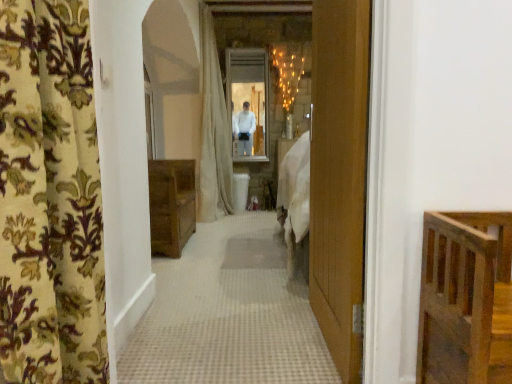
The height and width of the screenshot is (384, 512). I want to click on white glossy mirror at center, so click(x=249, y=101).

Locate an element on the screen. Image resolution: width=512 pixels, height=384 pixels. curtain below the beige fabric shower curtain at center (from a real-world perspective) is located at coordinates (50, 198).

What's the angular difference between beige fabric shower curtain at center and floral-patterned fabric at left's facing directions?

beige fabric shower curtain at center and floral-patterned fabric at left are facing 2.16 degrees away from each other.

Is the depth of beige fabric shower curtain at center greater than that of floral-patterned fabric at left?

Yes.

Which of these two, beige fabric shower curtain at center or floral-patterned fabric at left, is wider?

With larger width is beige fabric shower curtain at center.

Which is in front, floral-patterned fabric at left or beige fabric shower curtain at center?

Positioned in front is floral-patterned fabric at left.

Who is shorter, floral-patterned fabric at left or beige fabric shower curtain at center?

floral-patterned fabric at left.

Is floral-patterned fabric at left at the right side of beige fabric shower curtain at center?

Yes.

Who is smaller, beige fabric shower curtain at center or white glossy mirror at center?

Smaller between the two is white glossy mirror at center.

From the image's perspective, is beige fabric shower curtain at center below white glossy mirror at center?

Indeed, from the image's perspective, beige fabric shower curtain at center is shown beneath white glossy mirror at center.

Is beige fabric shower curtain at center positioned with its back to white glossy mirror at center?

beige fabric shower curtain at center does not have its back to white glossy mirror at center.

Which point is more distant from viewer, (202, 29) or (263, 155)?

The point (263, 155) is more distant.

In terms of width, does white glossy mirror at center look wider or thinner when compared to beige fabric shower curtain at center?

Clearly, white glossy mirror at center has less width compared to beige fabric shower curtain at center.

Is beige fabric shower curtain at center at the back of white glossy mirror at center?

No, white glossy mirror at center is not facing away from beige fabric shower curtain at center.

What's the angular difference between white glossy mirror at center and beige fabric shower curtain at center's facing directions?

There is a 88.4-degree angle between the facing directions of white glossy mirror at center and beige fabric shower curtain at center.

What are the coordinates of `mirror behind the beige fabric shower curtain at center` in the screenshot? It's located at (249, 101).

Between floral-patterned fabric at left and white glossy mirror at center, which one appears on the right side from the viewer's perspective?

white glossy mirror at center is more to the right.

Is floral-patterned fabric at left bigger than white glossy mirror at center?

Indeed, floral-patterned fabric at left has a larger size compared to white glossy mirror at center.

From the image's perspective, between floral-patterned fabric at left and white glossy mirror at center, which one is located above?

white glossy mirror at center is shown above in the image.

In the scene shown: Is floral-patterned fabric at left not close to white glossy mirror at center?

That's right, there is a large distance between floral-patterned fabric at left and white glossy mirror at center.

From the image's perspective, which is above, white glossy mirror at center or floral-patterned fabric at left?

white glossy mirror at center.

Based on the photo, is white glossy mirror at center in front of or behind floral-patterned fabric at left in the image?

white glossy mirror at center is behind floral-patterned fabric at left.

Is white glossy mirror at center in contact with floral-patterned fabric at left?

There is a gap between white glossy mirror at center and floral-patterned fabric at left.

Does point (244, 71) come closer to viewer compared to point (53, 285)?

No, it is behind (53, 285).

This screenshot has height=384, width=512. What are the coordinates of `curtain on the right of beige fabric shower curtain at center` in the screenshot? It's located at (50, 198).

The height and width of the screenshot is (384, 512). I want to click on shower curtain lying above the floral-patterned fabric at left (from the image's perspective), so click(x=213, y=132).

When comparing their distances from white glossy mirror at center, does floral-patterned fabric at left or beige fabric shower curtain at center seem further?

floral-patterned fabric at left is further to white glossy mirror at center.

When comparing their distances from floral-patterned fabric at left, does white glossy mirror at center or beige fabric shower curtain at center seem closer?

beige fabric shower curtain at center.

Considering their positions, is white glossy mirror at center positioned closer to beige fabric shower curtain at center than floral-patterned fabric at left?

white glossy mirror at center lies closer to beige fabric shower curtain at center than the other object.

Based on their spatial positions, is beige fabric shower curtain at center or floral-patterned fabric at left closer to white glossy mirror at center?

beige fabric shower curtain at center lies closer to white glossy mirror at center than the other object.

Which object lies further to the anchor point floral-patterned fabric at left, beige fabric shower curtain at center or white glossy mirror at center?

white glossy mirror at center is further to floral-patterned fabric at left.

Estimate the real-world distances between objects in this image. Which object is further from beige fabric shower curtain at center, floral-patterned fabric at left or white glossy mirror at center?

Based on the image, floral-patterned fabric at left appears to be further to beige fabric shower curtain at center.

The height and width of the screenshot is (384, 512). I want to click on shower curtain between floral-patterned fabric at left and white glossy mirror at center along the z-axis, so click(213, 132).